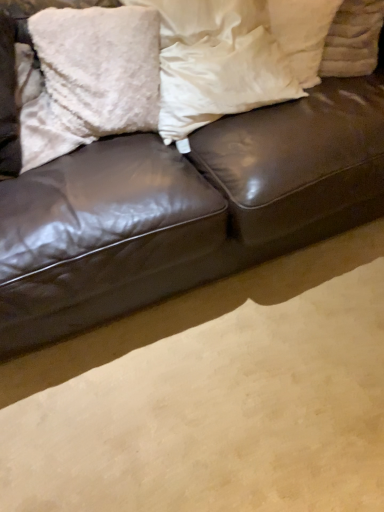
Question: Does white fluffy pillow at upper right, positioned as the 3th pillow in left-to-right order, have a lesser width compared to white soft pillow at center, the 2th pillow viewed from the left?

Choices:
 (A) yes
 (B) no

Answer: (A)

Question: Considering the relative positions of white fluffy pillow at upper right, which is the 1th pillow in right-to-left order, and white soft pillow at center, the 2th pillow viewed from the left, in the image provided, is white fluffy pillow at upper right, which is the 1th pillow in right-to-left order, to the right of white soft pillow at center, the 2th pillow viewed from the left, from the viewer's perspective?

Choices:
 (A) no
 (B) yes

Answer: (B)

Question: Can you confirm if white fluffy pillow at upper right, which is the 1th pillow in right-to-left order, is wider than white soft pillow at center, the 2th pillow viewed from the left?

Choices:
 (A) no
 (B) yes

Answer: (A)

Question: From a real-world perspective, does white fluffy pillow at upper right, positioned as the 3th pillow in left-to-right order, stand above white soft pillow at center, the 2th pillow viewed from the left?

Choices:
 (A) no
 (B) yes

Answer: (A)

Question: Is white fluffy pillow at upper right, positioned as the 3th pillow in left-to-right order, positioned before white soft pillow at center, the 2th pillow viewed from the left?

Choices:
 (A) no
 (B) yes

Answer: (A)

Question: Is white fluffy pillow at upper right, positioned as the 3th pillow in left-to-right order, taller or shorter than white soft pillow at center, the 2th pillow viewed from the left?

Choices:
 (A) tall
 (B) short

Answer: (B)

Question: Is white fluffy pillow at upper right, positioned as the 3th pillow in left-to-right order, bigger or smaller than white soft pillow at center, the 2th pillow viewed from the left?

Choices:
 (A) big
 (B) small

Answer: (B)

Question: Is white fluffy pillow at upper right, positioned as the 3th pillow in left-to-right order, wider or thinner than white soft pillow at center, the second pillow in the right-to-left sequence?

Choices:
 (A) wide
 (B) thin

Answer: (B)

Question: From the image's perspective, relative to white soft pillow at center, the 2th pillow viewed from the left, is white fluffy pillow at upper right, positioned as the 3th pillow in left-to-right order, above or below?

Choices:
 (A) above
 (B) below

Answer: (A)

Question: Visually, is fluffy white pillow at upper left, arranged as the first pillow when viewed from the left, positioned to the left or to the right of white fluffy pillow at upper right, which is the 1th pillow in right-to-left order?

Choices:
 (A) right
 (B) left

Answer: (B)

Question: From a real-world perspective, is fluffy white pillow at upper left, which ranks as the 3th pillow in right-to-left order, positioned above or below white fluffy pillow at upper right, which is the 1th pillow in right-to-left order?

Choices:
 (A) above
 (B) below

Answer: (A)

Question: Based on their sizes in the image, would you say fluffy white pillow at upper left, arranged as the first pillow when viewed from the left, is bigger or smaller than white fluffy pillow at upper right, positioned as the 3th pillow in left-to-right order?

Choices:
 (A) big
 (B) small

Answer: (A)

Question: Considering the positions of fluffy white pillow at upper left, which ranks as the 3th pillow in right-to-left order, and white fluffy pillow at upper right, positioned as the 3th pillow in left-to-right order, in the image, is fluffy white pillow at upper left, which ranks as the 3th pillow in right-to-left order, wider or thinner than white fluffy pillow at upper right, positioned as the 3th pillow in left-to-right order,?

Choices:
 (A) wide
 (B) thin

Answer: (B)

Question: Considering the positions of point (92, 46) and point (223, 72), is point (92, 46) closer or farther from the camera than point (223, 72)?

Choices:
 (A) closer
 (B) farther

Answer: (A)

Question: Relative to white soft pillow at center, the 2th pillow viewed from the left, is fluffy white pillow at upper left, arranged as the first pillow when viewed from the left, in front or behind?

Choices:
 (A) behind
 (B) front

Answer: (A)